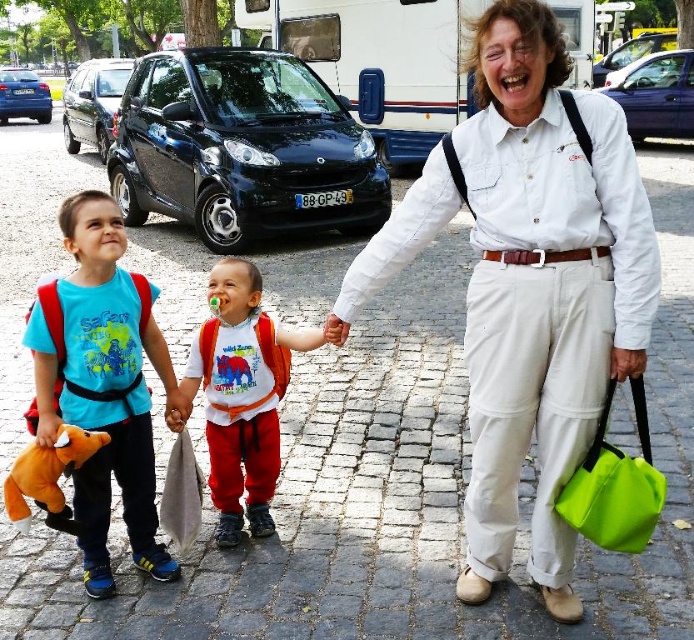
Question: From the image, what is the correct spatial relationship of blue cotton shirt at left in relation to soft plush toy at left?

Choices:
 (A) left
 (B) right

Answer: (B)

Question: Based on their relative distances, which object is nearer to the soft plush toy at left?

Choices:
 (A) white cotton shirt at center
 (B) blue cotton shirt at left
 (C) orange fabric backpack at center

Answer: (B)

Question: Which object is the farthest from the white cotton shirt at center?

Choices:
 (A) orange fabric backpack at center
 (B) blue cotton shirt at left

Answer: (B)

Question: Does white cotton shirt at center have a lesser width compared to soft plush toy at left?

Choices:
 (A) yes
 (B) no

Answer: (B)

Question: Can you confirm if white cotton shirt at center is smaller than orange fabric backpack at center?

Choices:
 (A) no
 (B) yes

Answer: (A)

Question: Which point appears farthest from the camera in this image?

Choices:
 (A) (101, 515)
 (B) (235, 433)

Answer: (B)